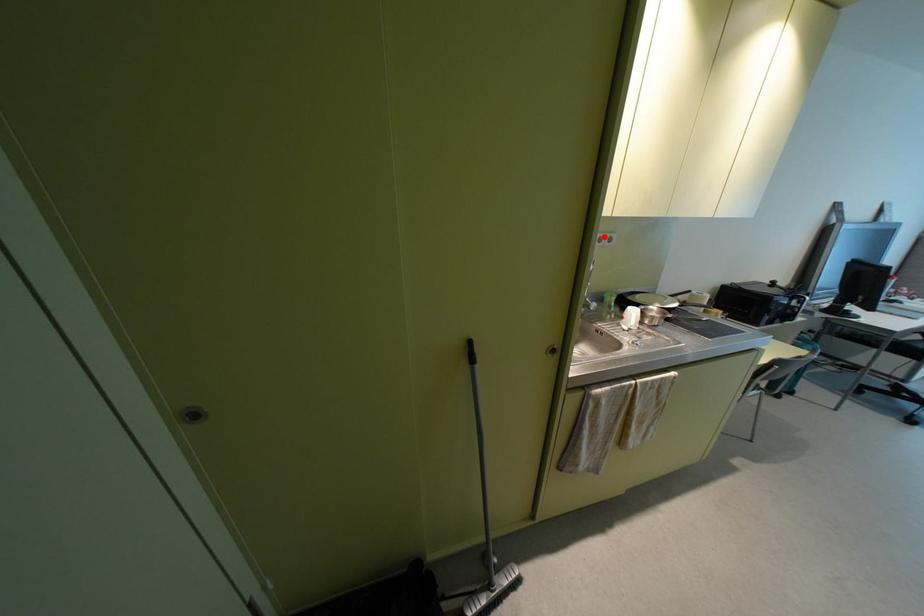
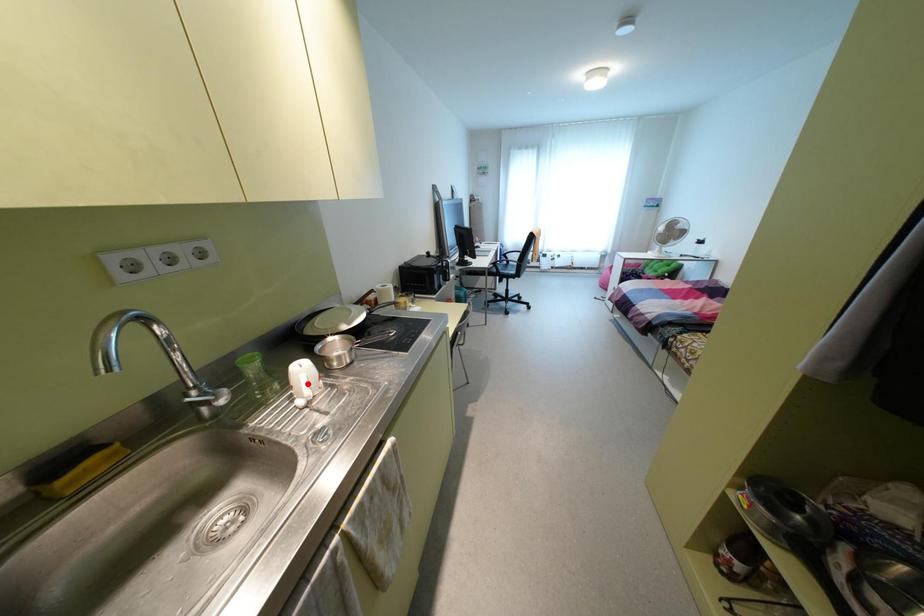
I am providing you with two images of the same scene from different viewpoints. A red point is marked on the first image and another point is marked on the second image. Is the marked point in image1 the same physical position as the marked point in image2?

No